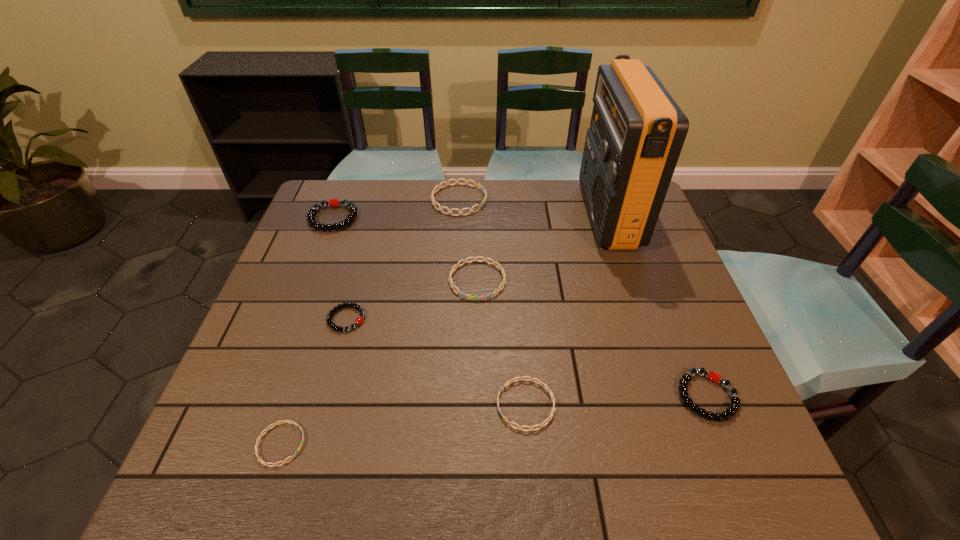
I want to click on vacant position located on the surface of the second smallest blue bracelet showing star-shaped elements, so click(350, 404).

I want to click on free space located 0.360m on the surface of the second smallest blue bracelet showing star-shaped elements, so click(x=321, y=404).

At what (x,y) coordinates should I click in order to perform the action: click on vacant position located 0.220m on the surface of the second smallest blue bracelet showing star-shaped elements. Please return your answer as a coordinate pair (x, y). The width and height of the screenshot is (960, 540). Looking at the image, I should click on (390, 404).

In order to click on vacant area located on the front of the smallest black bracelet in this screenshot , I will do `click(325, 395)`.

Where is `free point located 0.290m on the surface of the leftmost blue bracelet showing star-shaped elements`? This screenshot has width=960, height=540. free point located 0.290m on the surface of the leftmost blue bracelet showing star-shaped elements is located at coordinates (455, 444).

Where is `radio receiver present at the far edge`? radio receiver present at the far edge is located at coordinates (637, 131).

The height and width of the screenshot is (540, 960). In order to click on object that is at the near edge in this screenshot , I will do `click(257, 442)`.

At what (x,y) coordinates should I click in order to perform the action: click on radio receiver that is at the right edge. Please return your answer as a coordinate pair (x, y). This screenshot has width=960, height=540. Looking at the image, I should click on (637, 131).

The width and height of the screenshot is (960, 540). What are the coordinates of `bracelet that is at the right edge` in the screenshot? It's located at (714, 377).

Identify the location of object at the far left corner. Image resolution: width=960 pixels, height=540 pixels. (335, 202).